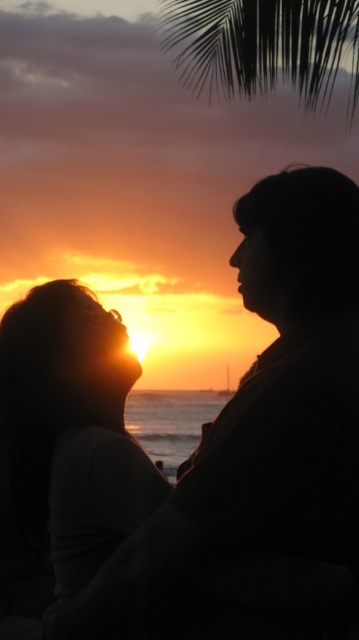
You are a photographer who wants to capture the sunset scene. You notice the silhouette couple at center and the matte black hair at lower left. Which object is located to the right of the other?

The silhouette couple at center is positioned on the right side of matte black hair at lower left.

You are an artist sketching the sunset scene. You want to draw the matte black hair at lower left and the green leafy palm tree at upper center. Which object should you draw first to maintain proper perspective?

You should draw the green leafy palm tree at upper center first because it is further away from the viewer compared to the matte black hair at lower left, which is closer. In perspective drawing, objects further away are typically drawn first to ensure proper layering.